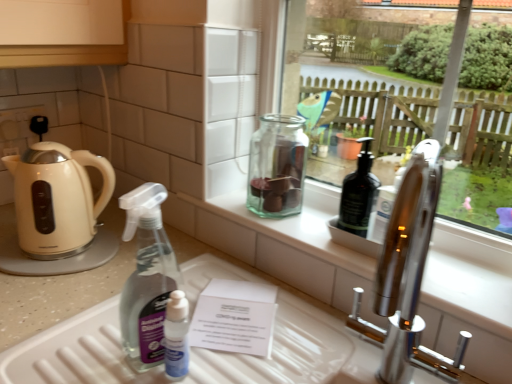
Question: Do you think beige glossy kettle at left is within white plastic tray at lower center, or outside of it?

Choices:
 (A) outside
 (B) inside

Answer: (A)

Question: Considering the positions of beige glossy kettle at left and white plastic tray at lower center in the image, is beige glossy kettle at left wider or thinner than white plastic tray at lower center?

Choices:
 (A) thin
 (B) wide

Answer: (A)

Question: Which is farther from the beige glossy kettle at left?

Choices:
 (A) green glass jar at center
 (B) white plastic tray at lower center

Answer: (A)

Question: Which of these objects is positioned closest to the green glass jar at center?

Choices:
 (A) beige glossy kettle at left
 (B) white plastic tray at lower center

Answer: (B)